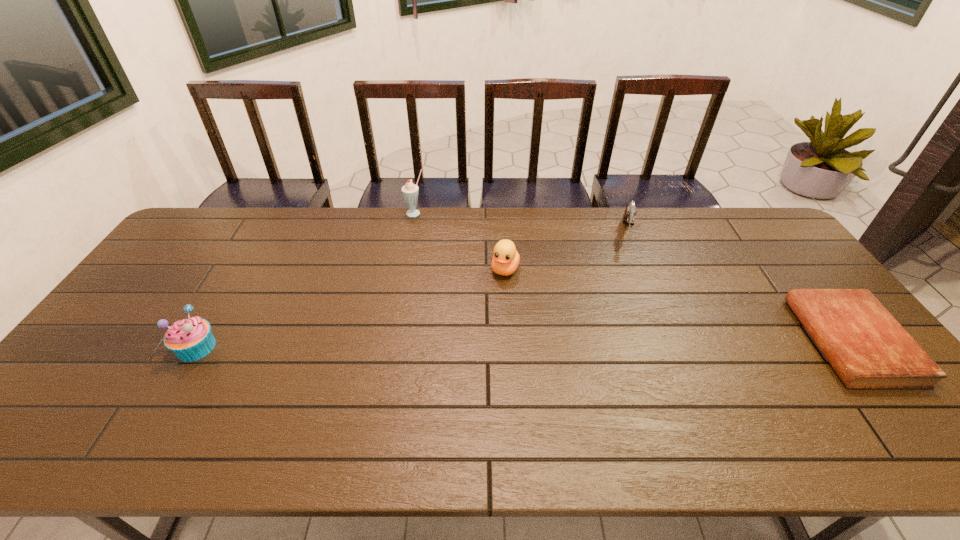
Identify the location of object that is the third closest to the muffin. The image size is (960, 540). (628, 217).

Identify which object is located as the fourth nearest to the third object from left to right. Please provide its 2D coordinates. Your answer should be formatted as a tuple, i.e. [(x, y)], where the tuple contains the x and y coordinates of a point satisfying the conditions above.

[(867, 347)]

Find the location of `vacant space that satisfies the following two spatial constraints: 1. on the back side of the shortest object; 2. on the spine side of the muffin`. vacant space that satisfies the following two spatial constraints: 1. on the back side of the shortest object; 2. on the spine side of the muffin is located at coordinates (201, 341).

In order to click on free location that satisfies the following two spatial constraints: 1. on the front side of the rightmost object; 2. on the spine side of the tallest object in this screenshot , I will do `click(392, 341)`.

The height and width of the screenshot is (540, 960). I want to click on vacant position in the image that satisfies the following two spatial constraints: 1. on the front side of the tallest object; 2. on the spine side of the rightmost object, so [x=392, y=341].

Where is `vacant region that satisfies the following two spatial constraints: 1. on the back side of the muffin; 2. on the right side of the tallest object`? Image resolution: width=960 pixels, height=540 pixels. vacant region that satisfies the following two spatial constraints: 1. on the back side of the muffin; 2. on the right side of the tallest object is located at coordinates (276, 213).

Identify the location of free spot that satisfies the following two spatial constraints: 1. on the back side of the rightmost object; 2. on the spine side of the leftmost object. (201, 341).

Find the location of a particular element. This screenshot has width=960, height=540. blank area in the image that satisfies the following two spatial constraints: 1. on the front side of the milkshake; 2. on the left side of the third object from left to right is located at coordinates (404, 269).